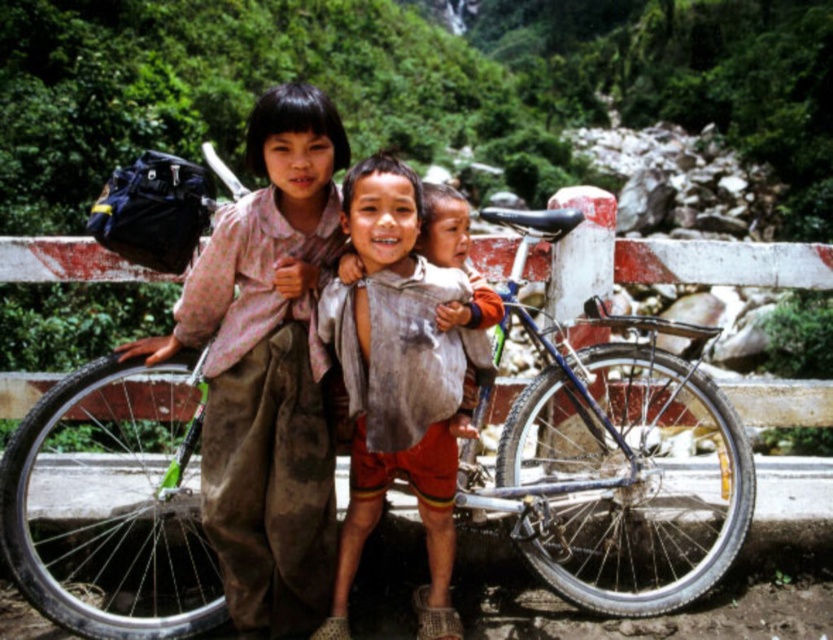
Does point (318, 470) come behind point (737, 579)?

No, (318, 470) is in front of (737, 579).

Between rusty metal bicycle at center and dusty mud track at lower center, which one is positioned lower?

dusty mud track at lower center is lower down.

You are a GUI agent. You are given a task and a screenshot of the screen. Output one action in this format:
    pyautogui.click(x=<x>, y=<y>)
    Task: Click on the rusty metal bicycle at center
    
    Given the screenshot: What is the action you would take?
    pyautogui.click(x=268, y=368)

Is dirty white shirt at center shorter than white painted wood fence at center?

Indeed, dirty white shirt at center has a lesser height compared to white painted wood fence at center.

Is point (367, 513) positioned behind point (754, 381)?

No, it is not.

You are a GUI agent. You are given a task and a screenshot of the screen. Output one action in this format:
    pyautogui.click(x=<x>, y=<y>)
    Task: Click on the dirty white shirt at center
    
    Given the screenshot: What is the action you would take?
    pyautogui.click(x=402, y=369)

Who is more distant from viewer, [188,397] or [272,582]?

The point [188,397] is behind.

In the scene shown: Does blue metallic bicycle at center lie in front of rusty metal bicycle at center?

No, blue metallic bicycle at center is behind rusty metal bicycle at center.

This screenshot has width=833, height=640. Describe the element at coordinates (616, 476) in the screenshot. I see `blue metallic bicycle at center` at that location.

Where is `blue metallic bicycle at center`? This screenshot has height=640, width=833. blue metallic bicycle at center is located at coordinates (616, 476).